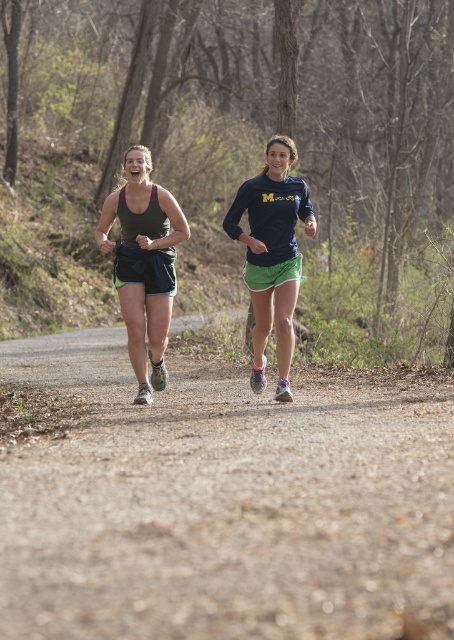
Question: Which point is closer to the camera?

Choices:
 (A) matte black tank top at center
 (B) matte blue shirt at center
 (C) dirt/gravel trail at center

Answer: (C)

Question: Which of the following is the farthest from the observer?

Choices:
 (A) dirt/gravel trail at center
 (B) matte black tank top at center

Answer: (B)

Question: Is dirt/gravel trail at center in front of matte blue shirt at center?

Choices:
 (A) yes
 (B) no

Answer: (A)

Question: Does dirt/gravel trail at center come behind matte black tank top at center?

Choices:
 (A) yes
 (B) no

Answer: (B)

Question: Which object is farther from the camera taking this photo?

Choices:
 (A) matte black tank top at center
 (B) dirt/gravel trail at center
 (C) matte blue shirt at center

Answer: (C)

Question: Can you confirm if dirt/gravel trail at center is thinner than matte blue shirt at center?

Choices:
 (A) no
 (B) yes

Answer: (B)